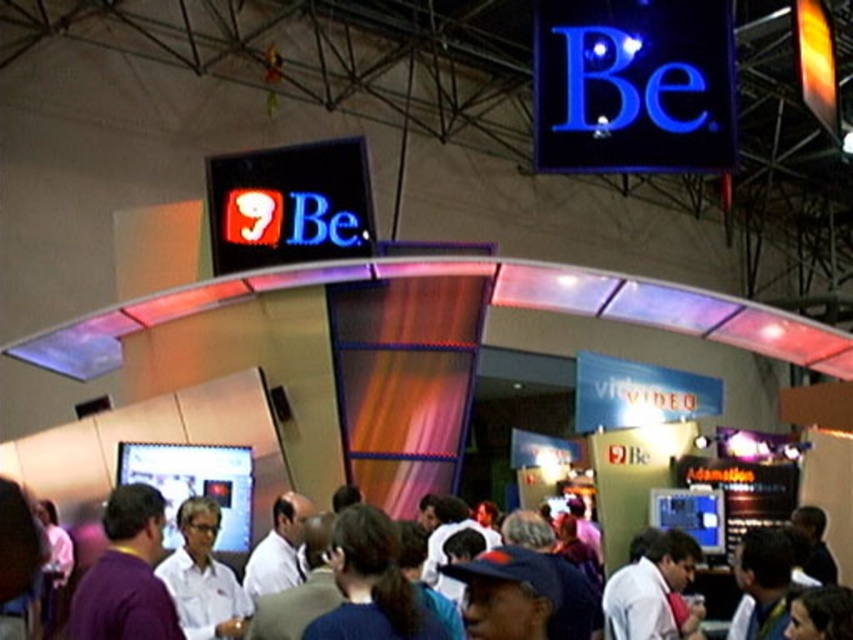
Question: Which point appears farthest from the camera in this image?

Choices:
 (A) (641, 588)
 (B) (126, 545)
 (C) (111, 600)

Answer: (A)

Question: Which point is farther from the camera taking this photo?

Choices:
 (A) (102, 637)
 (B) (630, 593)

Answer: (B)

Question: Is white shirt at center thinner than white matte shirt at center?

Choices:
 (A) no
 (B) yes

Answer: (B)

Question: Based on their relative distances, which object is farther from the white shirt at center?

Choices:
 (A) white shirt at lower right
 (B) white matte shirt at center

Answer: (A)

Question: Can you confirm if purple shirt at lower left is bigger than white matte shirt at center?

Choices:
 (A) yes
 (B) no

Answer: (A)

Question: Does purple shirt at lower left appear on the left side of white shirt at center?

Choices:
 (A) no
 (B) yes

Answer: (B)